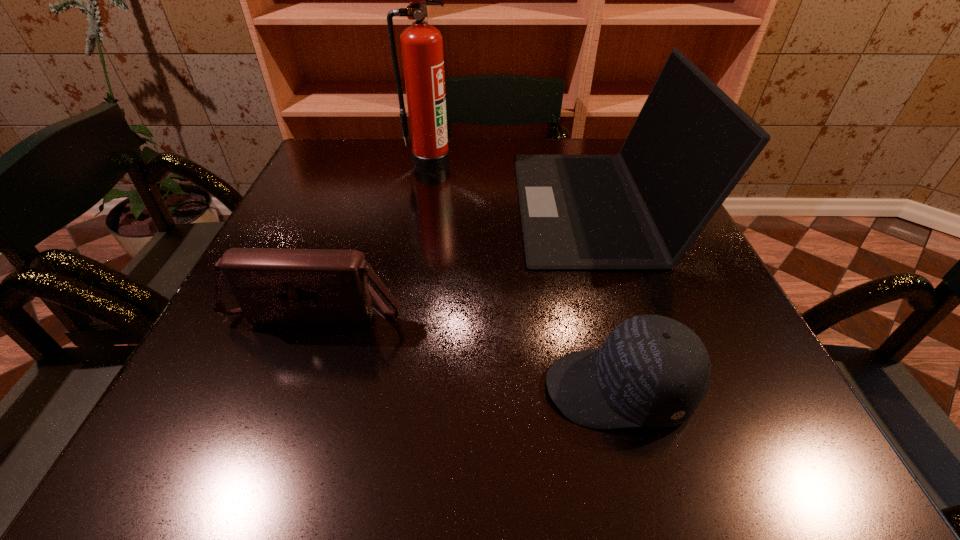
Identify the location of empty space between the third shortest object and the shortest object. (608, 296).

The image size is (960, 540). I want to click on free space between the shortest object and the second tallest object, so click(608, 296).

This screenshot has width=960, height=540. Find the location of `vacant space in between the tallest object and the third tallest object`. vacant space in between the tallest object and the third tallest object is located at coordinates (373, 237).

Find the location of a particular element. This screenshot has width=960, height=540. blank region between the nearest object and the fire extinguisher is located at coordinates (524, 275).

The height and width of the screenshot is (540, 960). I want to click on unoccupied area between the third farthest object and the fire extinguisher, so click(x=373, y=237).

Find the location of a particular element. free point between the nearest object and the shoulder bag is located at coordinates (468, 349).

Find the location of `object that can be found as the second closest to the shoulder bag`. object that can be found as the second closest to the shoulder bag is located at coordinates (652, 371).

Locate which object is the third closest to the nearest object. Please provide its 2D coordinates. Your answer should be formatted as a tuple, i.e. [(x, y)], where the tuple contains the x and y coordinates of a point satisfying the conditions above.

[(421, 43)]

The width and height of the screenshot is (960, 540). I want to click on free space in the image that satisfies the following two spatial constraints: 1. on the screen of the laptop; 2. on the front flap of the second shortest object, so click(x=633, y=310).

Image resolution: width=960 pixels, height=540 pixels. Identify the location of vacant area that satisfies the following two spatial constraints: 1. on the screen of the second tallest object; 2. on the front flap of the third tallest object. (633, 310).